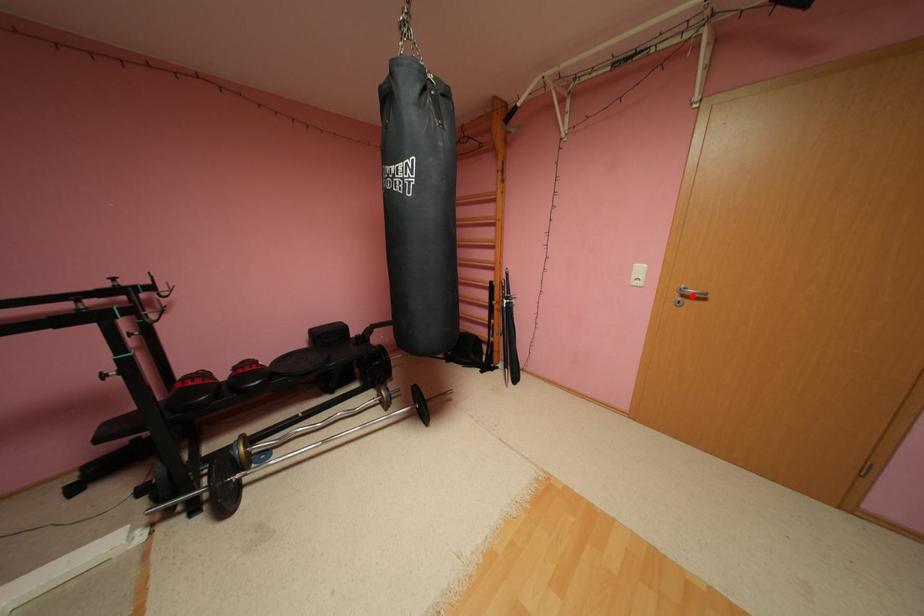
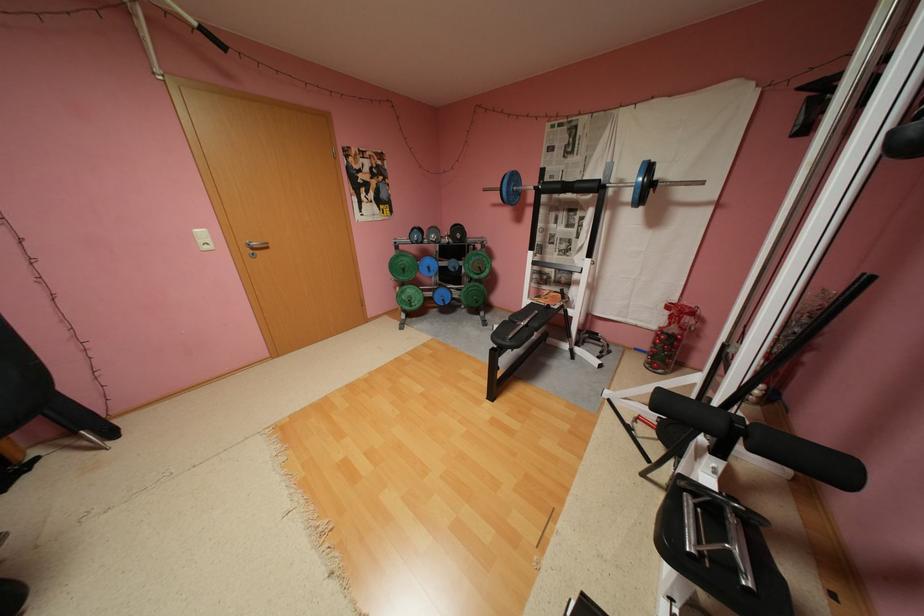
Locate, in the second image, the point that corresponds to the highlighted location in the first image.

(262, 249)